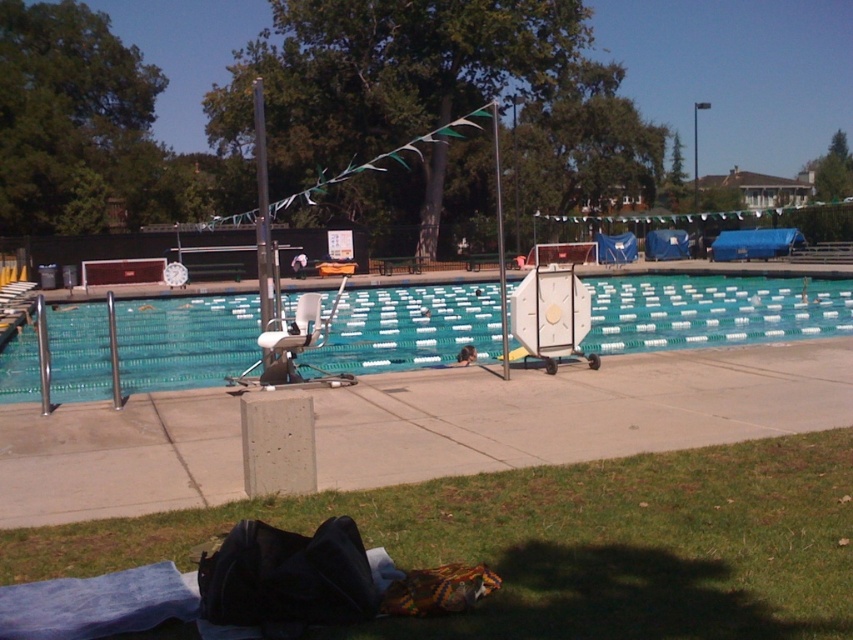
You are standing at the grassy area where the black bag and colorful patterned item are located. You need to retrieve an object from the silver metallic pole at center. Which direction should you walk to reach it?

The silver metallic pole at center is located at coordinates point (262, 209). Since you are at the grassy area with the black bag and colorful patterned item, you should walk towards the center of the pool area to reach the silver metallic pole at center.

You are standing at the edge of the pool and want to place a small potted plant between the green grass at lower center and the metallic pole at center. Can the potted plant fit in the space between them?

The green grass at lower center is smaller than the metallic pole at center, so there is enough space to place the potted plant between them.